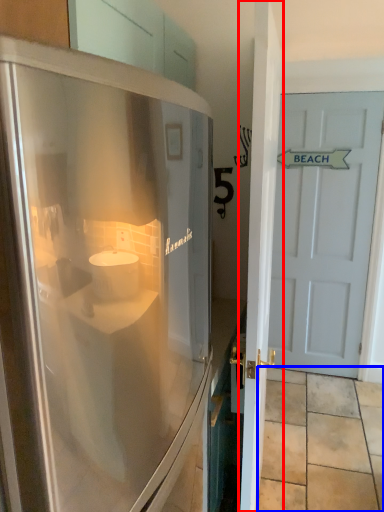
Question: Among these objects, which one is nearest to the camera, door (highlighted by a red box) or tile (highlighted by a blue box)?

Choices:
 (A) door
 (B) tile

Answer: (A)